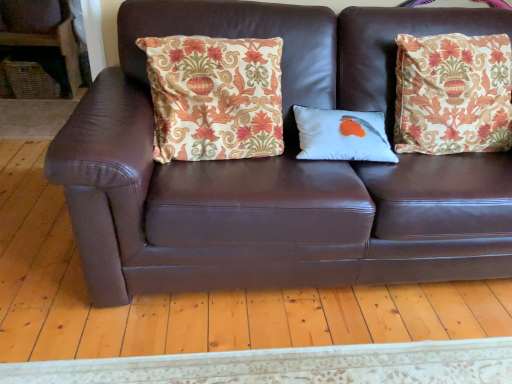
Question: Is point (105, 87) closer or farther from the camera than point (5, 61)?

Choices:
 (A) closer
 (B) farther

Answer: (A)

Question: In terms of width, does brown leather couch at center look wider or thinner when compared to woven wicker basket at left?

Choices:
 (A) thin
 (B) wide

Answer: (B)

Question: Based on their relative distances, which object is farther from the brown leather couch at center?

Choices:
 (A) white matte pillow with bird design at center, acting as the first pillow starting from the right
 (B) woven wicker basket at left
 (C) patterned fabric pillow at center, the second pillow positioned from the right

Answer: (B)

Question: Estimate the real-world distances between objects in this image. Which object is farther from the white matte pillow with bird design at center, acting as the first pillow starting from the right?

Choices:
 (A) woven wicker basket at left
 (B) brown leather couch at center
 (C) patterned fabric pillow at center, the first pillow from the left

Answer: (A)